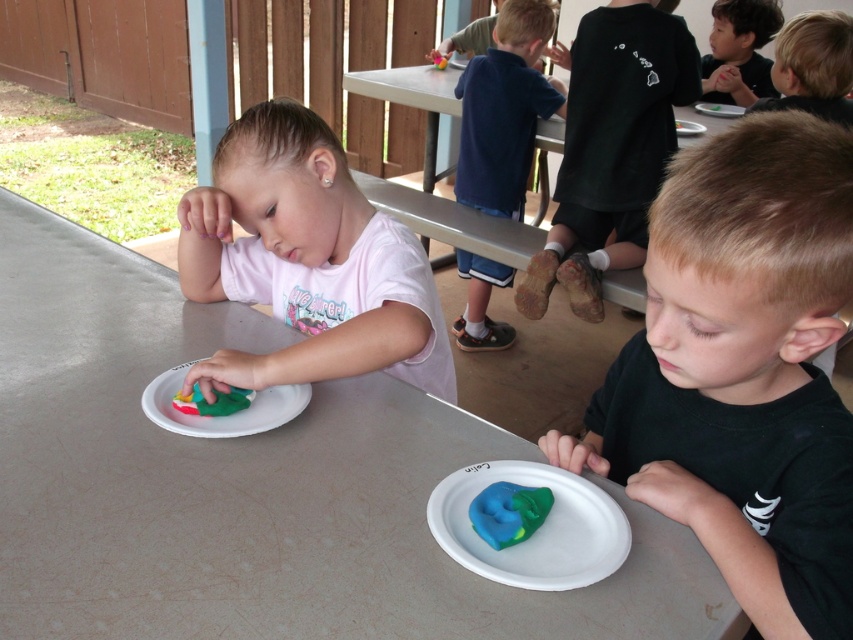
What do you see at coordinates (743, 371) in the screenshot? The width and height of the screenshot is (853, 640). I see `smooth black shirt at center` at bounding box center [743, 371].

Does smooth black shirt at center appear on the left side of blue clay sculpture at lower right?

Incorrect, smooth black shirt at center is not on the left side of blue clay sculpture at lower right.

Between point (781, 508) and point (502, 518), which one is positioned in front?

Point (502, 518) is in front.

I want to click on smooth black shirt at center, so click(743, 371).

Can you confirm if dark gray t-shirt at upper right is wider than smooth black shirt at upper right?

Correct, the width of dark gray t-shirt at upper right exceeds that of smooth black shirt at upper right.

Is point (618, 230) positioned after point (773, 4)?

That is False.

Locate an element on the screen. dark gray t-shirt at upper right is located at coordinates (611, 148).

Locate an element on the screen. dark gray t-shirt at upper right is located at coordinates (611, 148).

Is point (701, 60) behind point (512, 524)?

Yes, it is behind point (512, 524).

Can you confirm if smooth black shirt at upper right is thinner than blue clay sculpture at lower right?

In fact, smooth black shirt at upper right might be wider than blue clay sculpture at lower right.

You are a GUI agent. You are given a task and a screenshot of the screen. Output one action in this format:
    pyautogui.click(x=<x>, y=<y>)
    Task: Click on the smooth black shirt at upper right
    The image size is (853, 640).
    Given the screenshot: What is the action you would take?
    pyautogui.click(x=740, y=51)